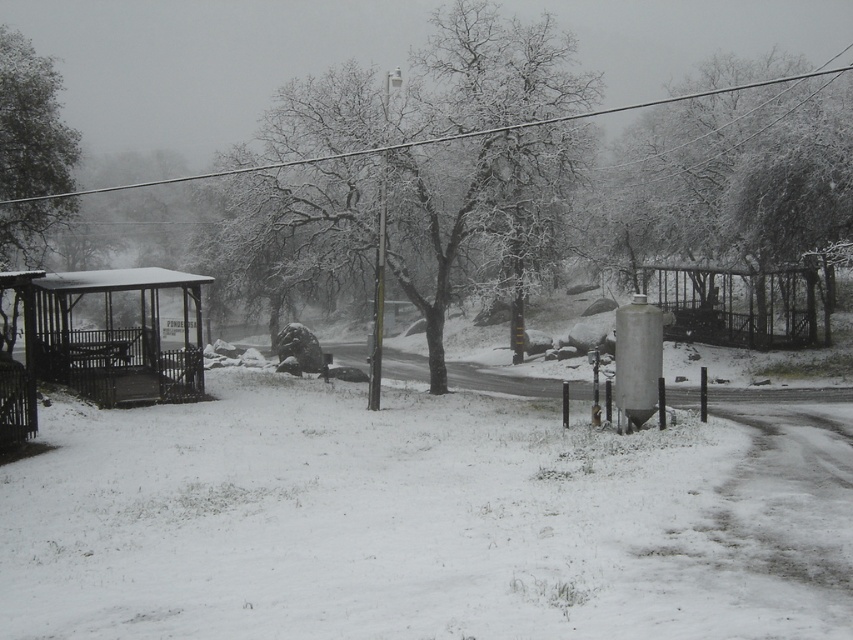
Does snow-covered tree at upper right have a greater width compared to metallic wire at upper center?

Incorrect, snow-covered tree at upper right's width does not surpass metallic wire at upper center's.

Is snow-covered tree at upper right shorter than metallic wire at upper center?

Indeed, snow-covered tree at upper right has a lesser height compared to metallic wire at upper center.

Measure the distance between point (653, 241) and camera.

A distance of 125.51 feet exists between point (653, 241) and camera.

Find the location of a particular element. The image size is (853, 640). snow-covered tree at upper right is located at coordinates (730, 204).

Can you confirm if snow-covered tree at center is positioned to the left of snow-covered tree at upper right?

Yes, snow-covered tree at center is to the left of snow-covered tree at upper right.

You are a GUI agent. You are given a task and a screenshot of the screen. Output one action in this format:
    pyautogui.click(x=<x>, y=<y>)
    Task: Click on the snow-covered tree at center
    Image resolution: width=853 pixels, height=640 pixels.
    Given the screenshot: What is the action you would take?
    pyautogui.click(x=445, y=172)

From the picture: Does snow-covered tree at center come in front of snow-covered tree at left?

Yes, it is in front of snow-covered tree at left.

Can you confirm if snow-covered tree at center is bigger than snow-covered tree at left?

Yes, snow-covered tree at center is bigger than snow-covered tree at left.

Find the location of a particular element. snow-covered tree at center is located at coordinates (445, 172).